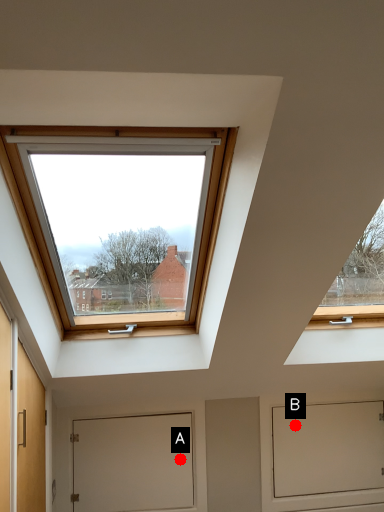
Question: Two points are circled on the image, labeled by A and B beside each circle. Which point is closer to the camera?

Choices:
 (A) A is closer
 (B) B is closer

Answer: (A)